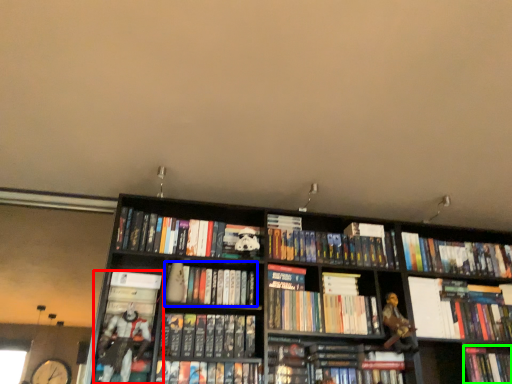
Question: Based on their relative distances, which object is nearer to book (highlighted by a red box)? Choose from book (highlighted by a blue box) and book (highlighted by a green box).

Choices:
 (A) book
 (B) book

Answer: (A)